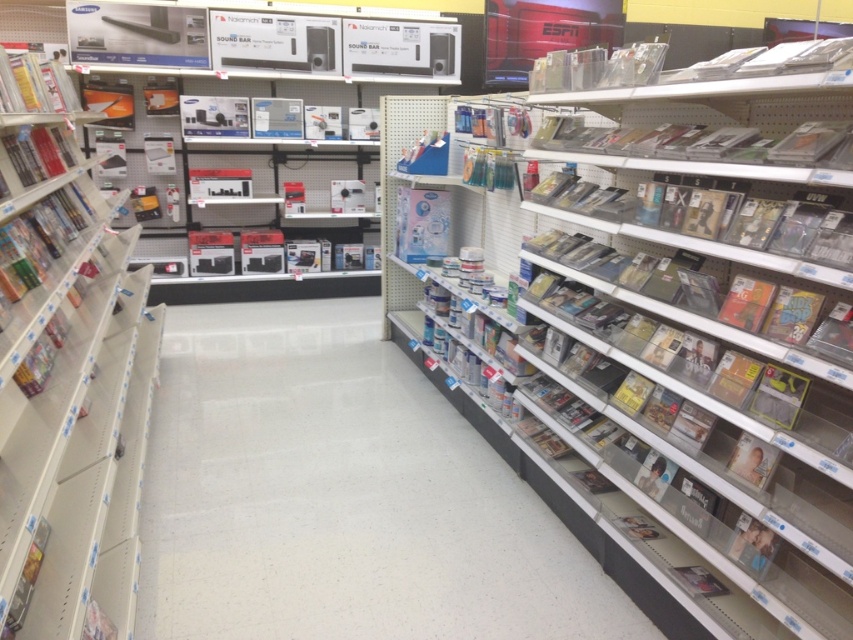
Question: Among these objects, which one is nearest to the camera?

Choices:
 (A) metallic silver bookshelf at left
 (B) white glossy floor at center

Answer: (A)

Question: Considering the relative positions of clear plastic books at center and metallic silver bookshelf at left in the image provided, where is clear plastic books at center located with respect to metallic silver bookshelf at left?

Choices:
 (A) right
 (B) left

Answer: (A)

Question: From the image, what is the correct spatial relationship of clear plastic books at center in relation to metallic silver bookshelf at left?

Choices:
 (A) left
 (B) right

Answer: (B)

Question: Among these objects, which one is nearest to the camera?

Choices:
 (A) metallic silver bookshelf at left
 (B) clear plastic books at center
 (C) white glossy floor at center

Answer: (A)

Question: Observing the image, what is the correct spatial positioning of clear plastic books at center in reference to metallic silver bookshelf at left?

Choices:
 (A) above
 (B) below

Answer: (A)

Question: Which point is farther to the camera?

Choices:
 (A) click(517, 324)
 (B) click(260, 541)

Answer: (A)